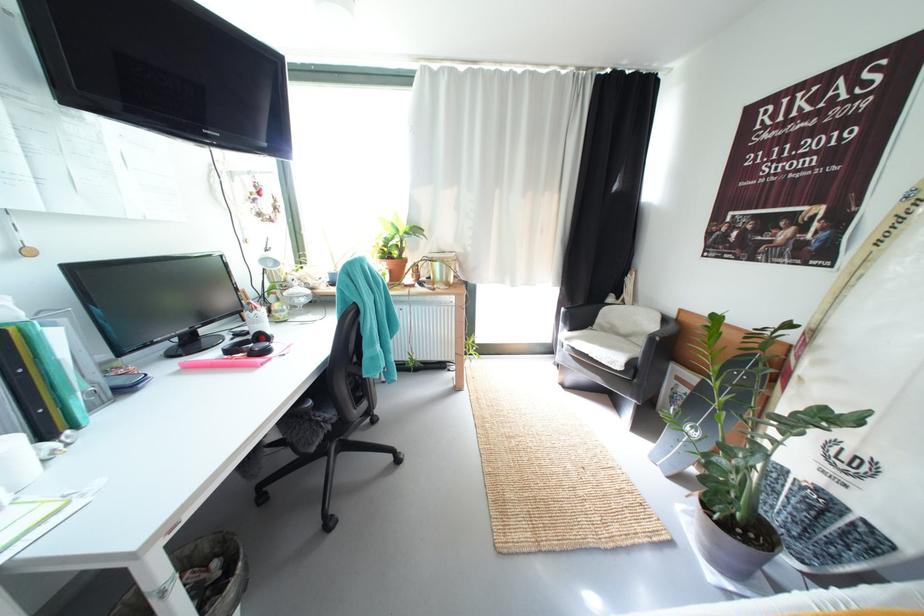
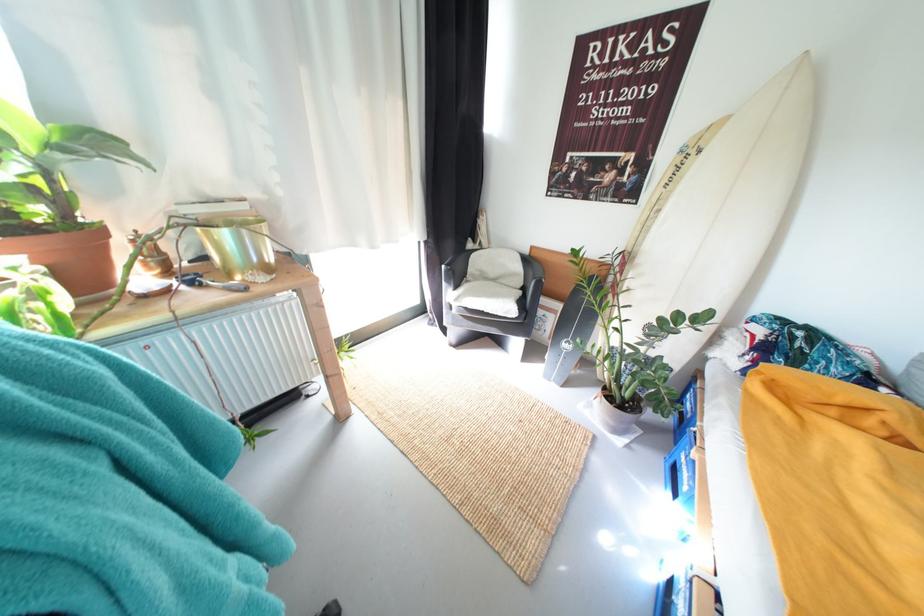
Based on the continuous images, in which direction is the camera rotating?

The rotation direction of the camera is right-down.